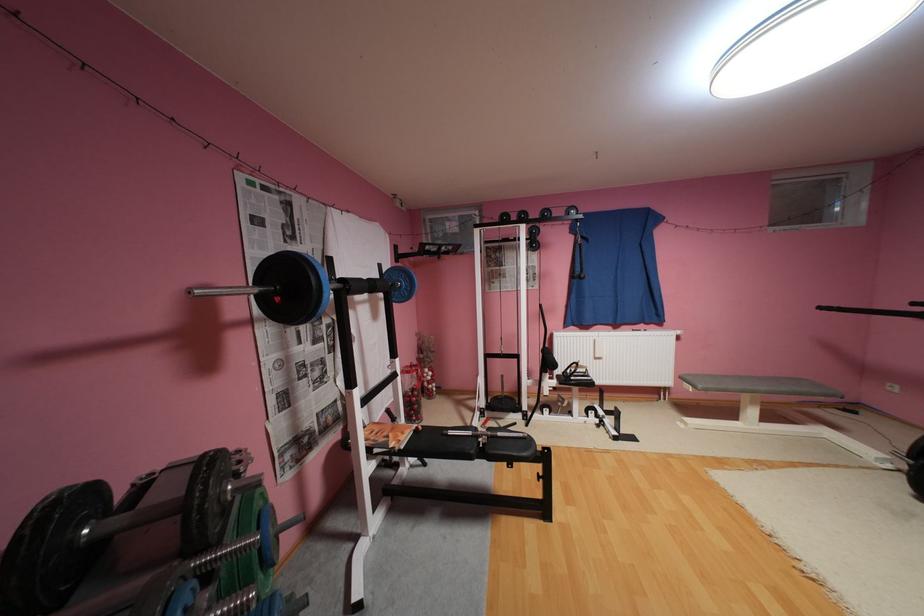
Describe the element at coordinates (759, 386) in the screenshot. I see `the white bench sitting surface` at that location.